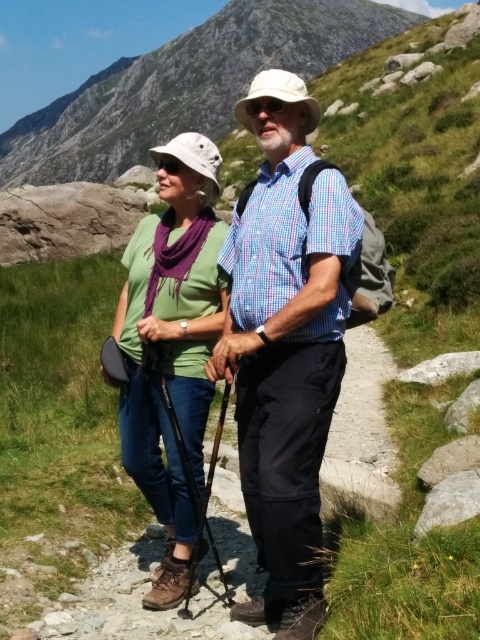
You are a hiker trying to decide which path to take. You see two hikers ahead of you wearing a matte blue shirt at center and a green matte shirt at center. Which hiker is closer to your right side?

The matte blue shirt at center is positioned on the right side of green matte shirt at center, so the hiker wearing the matte blue shirt at center is closer to your right side.

You are planning to place a rectangular sign that is 1 meter wide between the granite rock at upper center and the green matte shirt at center. Based on the available space, will the sign fit without overlapping either object?

The granite rock at upper center might be wider than green matte shirt at center, so the space between them may not be sufficient to fit a 1 meter wide sign without overlapping. Check the exact width before placing the sign.